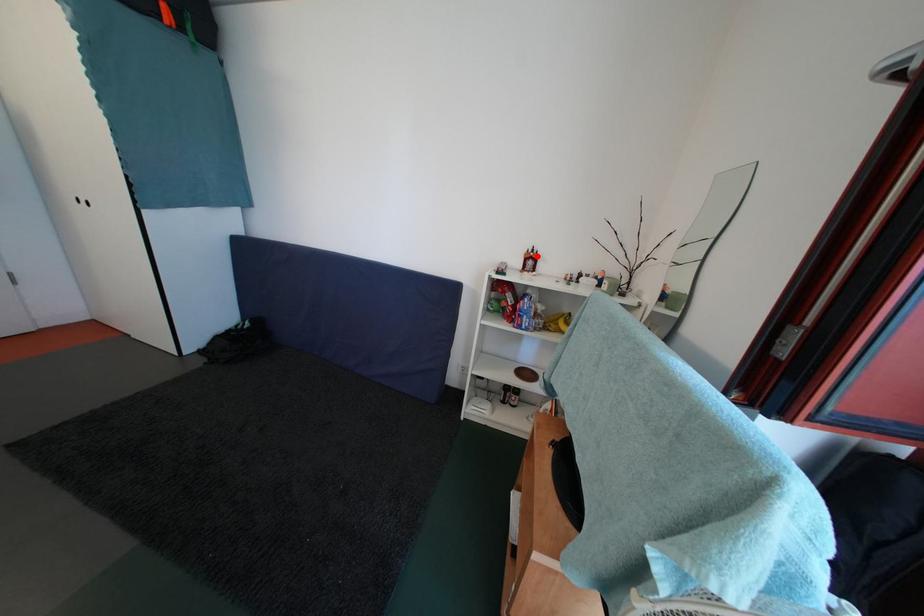
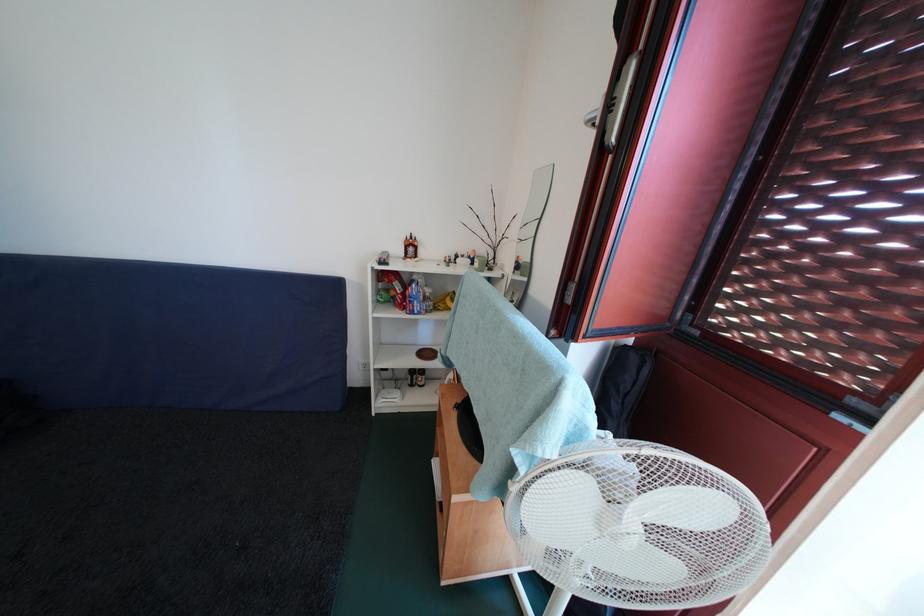
Find the pixel in the second image that matches the highlighted location in the first image.

(416, 243)